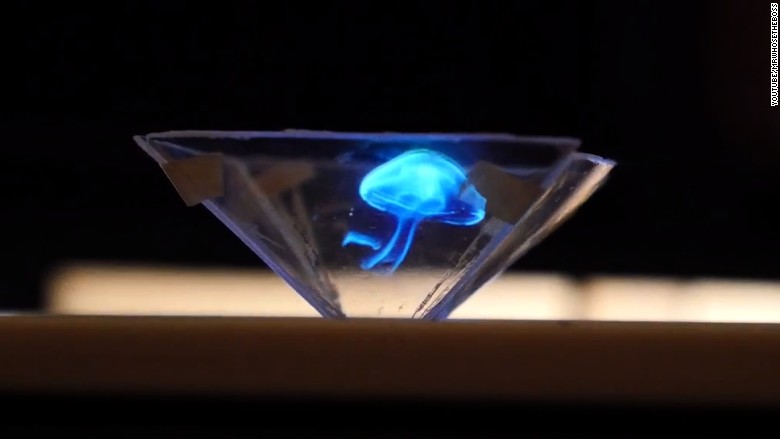
Where is `wall`? Image resolution: width=780 pixels, height=439 pixels. wall is located at coordinates [x=600, y=79], [x=105, y=78].